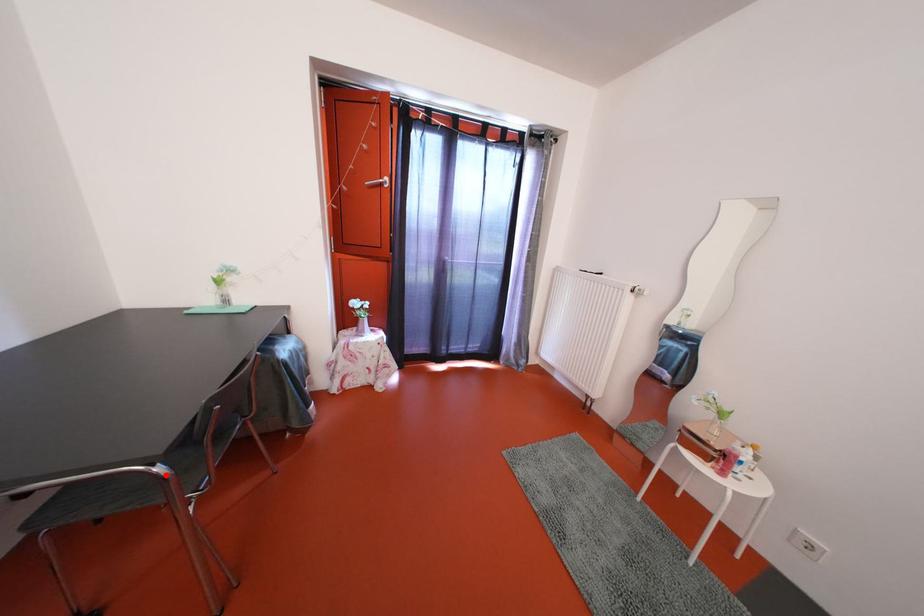
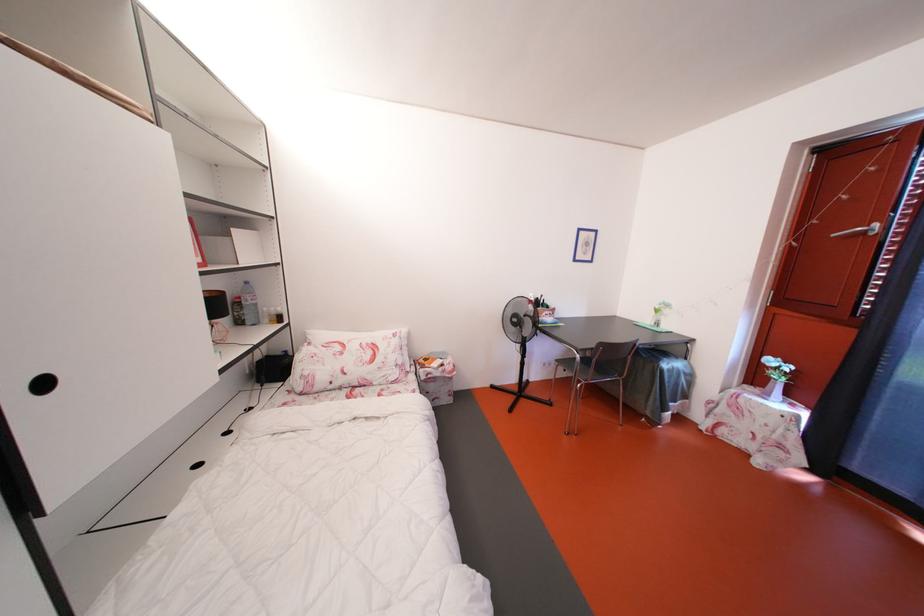
Question: I am providing you with two images of the same scene from different viewpoints. A red point is shown in image1. For the corresponding object point in image2, is it positioned nearer or farther from the camera?

Choices:
 (A) Nearer
 (B) Farther

Answer: (A)